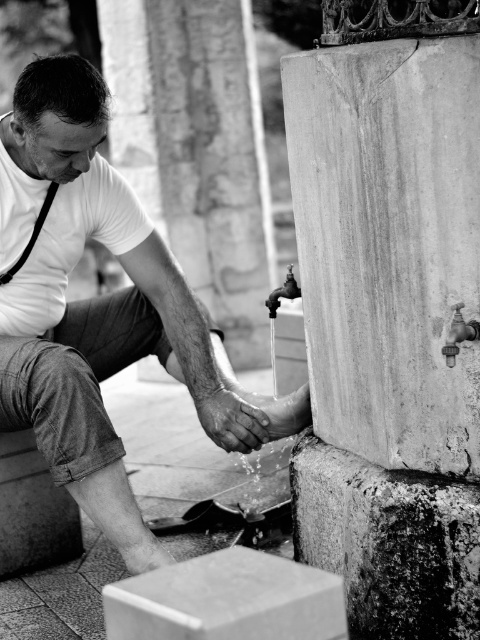
Describe the element at coordinates (389, 308) in the screenshot. I see `smooth stone pillar at right` at that location.

Is smooth stone pillar at right further to the viewer compared to matte white shirt at left?

No, smooth stone pillar at right is closer to the viewer.

Based on the photo, who is more distant from viewer, (335, 250) or (74, 433)?

Positioned behind is point (74, 433).

Locate an element on the screen. This screenshot has width=480, height=640. smooth stone pillar at right is located at coordinates (389, 308).

Does matte white shirt at left have a greater width compared to black leather suspenders at left?

Correct, the width of matte white shirt at left exceeds that of black leather suspenders at left.

Which is more to the right, matte white shirt at left or black leather suspenders at left?

From the viewer's perspective, matte white shirt at left appears more on the right side.

The image size is (480, 640). In order to click on matte white shirt at left in this screenshot , I will do `click(100, 308)`.

Who is more forward, [467,401] or [52,186]?

Positioned in front is point [467,401].

How much distance is there between smooth stone pillar at right and black leather suspenders at left?

smooth stone pillar at right is 1.49 meters away from black leather suspenders at left.

Find the location of a particular element. smooth stone pillar at right is located at coordinates (389, 308).